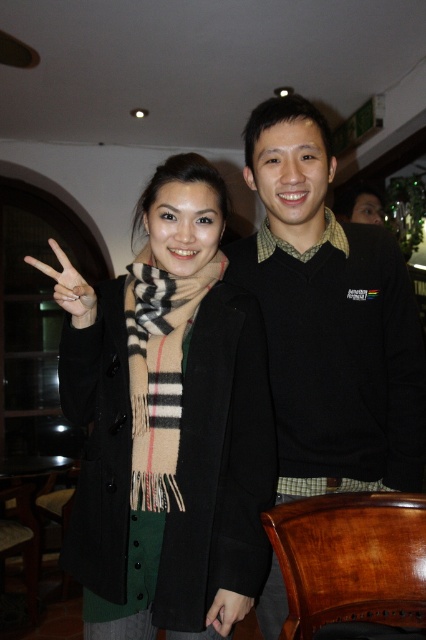
Consider the image. Can you confirm if black sweater at right is thinner than matte black hand at lower center?

Incorrect, black sweater at right's width is not less than matte black hand at lower center's.

Does point (334, 292) come closer to viewer compared to point (218, 612)?

No, (334, 292) is behind (218, 612).

The height and width of the screenshot is (640, 426). Identify the location of black sweater at right. (328, 317).

Which of these two, black wool scarf at center or black sweater at right, stands shorter?

With less height is black wool scarf at center.

Does black wool scarf at center have a greater height compared to black sweater at right?

No, black wool scarf at center is not taller than black sweater at right.

Does point (62, 560) come closer to viewer compared to point (344, 490)?

Yes, point (62, 560) is closer to viewer.

At what (x,y) coordinates should I click in order to perform the action: click on black wool scarf at center. Please return your answer as a coordinate pair (x, y). This screenshot has width=426, height=640. Looking at the image, I should click on (169, 422).

Is black sweater at right positioned behind plaid wool scarf at center?

Yes, it is.

Does black sweater at right have a smaller size compared to plaid wool scarf at center?

No.

Between point (276, 257) and point (172, 390), which one is positioned behind?

Positioned behind is point (276, 257).

The image size is (426, 640). In order to click on black sweater at right in this screenshot , I will do `click(328, 317)`.